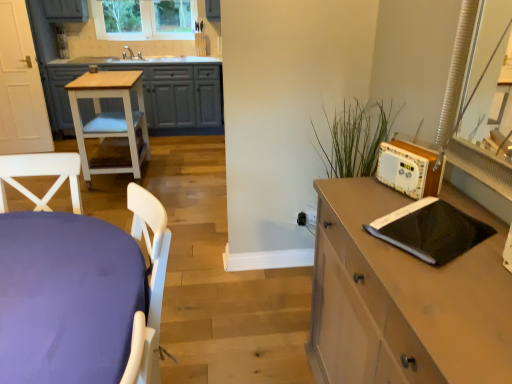
I want to click on free space in front of black matte notebook at right, so click(452, 286).